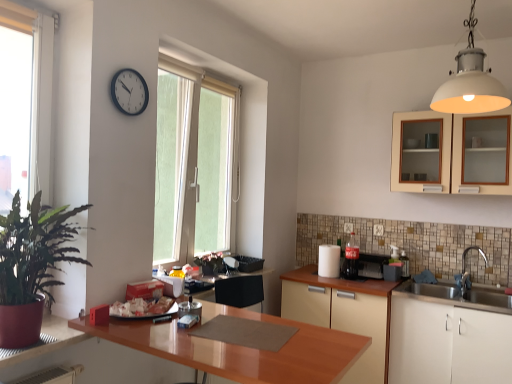
Locate an element on the screen. The height and width of the screenshot is (384, 512). free space in front of clear glass soda bottle at center-right, which ranks as the 2th appliance in right-to-left order is located at coordinates (346, 284).